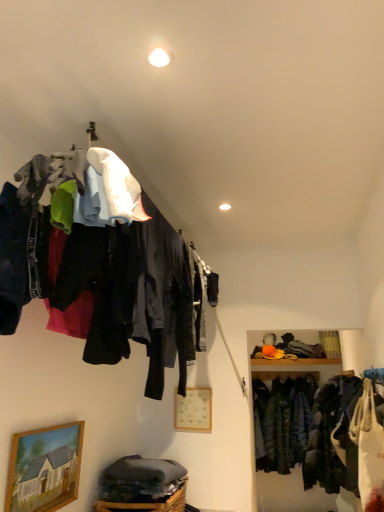
Question: Is wooden picture frame at center, placed as the second picture frame when sorted from front to back, next to wooden framed painting at lower left, the 2th picture frame from the back?

Choices:
 (A) yes
 (B) no

Answer: (B)

Question: Is wooden picture frame at center, the first picture frame when ordered from right to left, smaller than wooden framed painting at lower left, which ranks as the first picture frame in front-to-back order?

Choices:
 (A) yes
 (B) no

Answer: (A)

Question: Considering the relative sizes of wooden picture frame at center, which ranks as the 2th picture frame in left-to-right order, and wooden framed painting at lower left, the 2th picture frame from the back, in the image provided, is wooden picture frame at center, which ranks as the 2th picture frame in left-to-right order, taller than wooden framed painting at lower left, the 2th picture frame from the back,?

Choices:
 (A) yes
 (B) no

Answer: (B)

Question: From a real-world perspective, does wooden picture frame at center, placed as the second picture frame when sorted from front to back, sit lower than wooden framed painting at lower left, which is the first picture frame in left-to-right order?

Choices:
 (A) yes
 (B) no

Answer: (B)

Question: Does wooden picture frame at center, the first picture frame when ordered from right to left, turn towards wooden framed painting at lower left, which ranks as the first picture frame in front-to-back order?

Choices:
 (A) no
 (B) yes

Answer: (B)

Question: Is wooden picture frame at center, acting as the first picture frame starting from the back, bigger than wooden framed painting at lower left, arranged as the second picture frame when viewed from the right?

Choices:
 (A) no
 (B) yes

Answer: (A)

Question: Can you confirm if woven brown basket at lower center is thinner than dark green quilted jacket at lower right?

Choices:
 (A) no
 (B) yes

Answer: (A)

Question: Is dark green quilted jacket at lower right a part of woven brown basket at lower center?

Choices:
 (A) yes
 (B) no

Answer: (B)

Question: Considering the relative sizes of woven brown basket at lower center and dark green quilted jacket at lower right in the image provided, is woven brown basket at lower center shorter than dark green quilted jacket at lower right?

Choices:
 (A) no
 (B) yes

Answer: (B)

Question: Does woven brown basket at lower center appear on the left side of dark green quilted jacket at lower right?

Choices:
 (A) yes
 (B) no

Answer: (A)

Question: From the image's perspective, is woven brown basket at lower center over dark green quilted jacket at lower right?

Choices:
 (A) no
 (B) yes

Answer: (B)

Question: From a real-world perspective, is woven brown basket at lower center below dark green quilted jacket at lower right?

Choices:
 (A) no
 (B) yes

Answer: (B)

Question: From a real-world perspective, does dark green quilted jacket at lower right stand above woven brown basket at lower center?

Choices:
 (A) yes
 (B) no

Answer: (A)